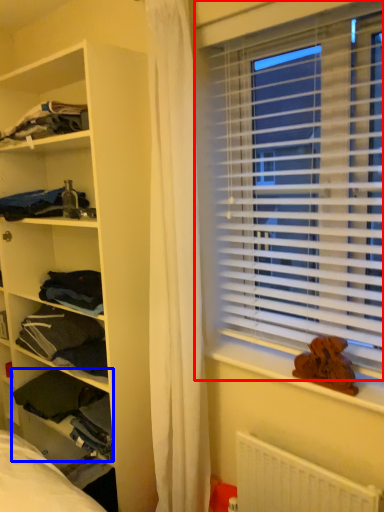
Question: Among these objects, which one is farthest to the camera, window blind (highlighted by a red box) or clothing (highlighted by a blue box)?

Choices:
 (A) window blind
 (B) clothing

Answer: (B)